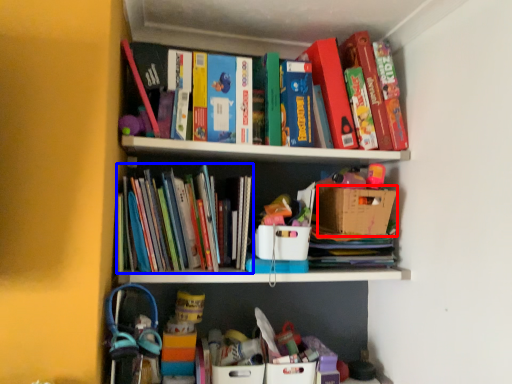
Question: Which object appears closest to the camera in this image, cardboard box (highlighted by a red box) or book (highlighted by a blue box)?

Choices:
 (A) cardboard box
 (B) book

Answer: (B)